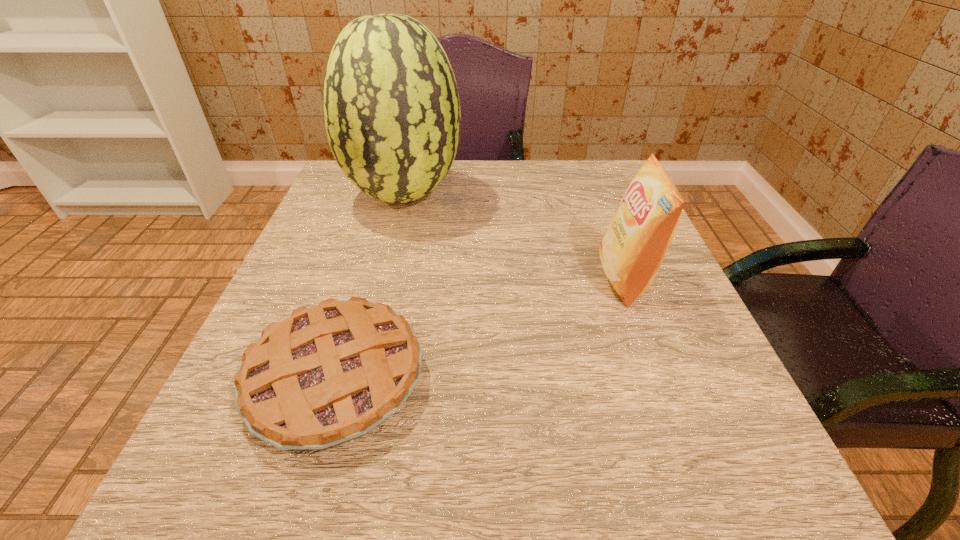
Find the location of `the tallest object`. the tallest object is located at coordinates (392, 114).

Find the location of a particular element. The width and height of the screenshot is (960, 540). the farthest object is located at coordinates (392, 114).

This screenshot has width=960, height=540. In order to click on the second nearest object in this screenshot , I will do `click(632, 249)`.

This screenshot has height=540, width=960. I want to click on the second shortest object, so click(x=632, y=249).

At what (x,y) coordinates should I click in order to perform the action: click on the nearest object. Please return your answer as a coordinate pair (x, y). The height and width of the screenshot is (540, 960). Looking at the image, I should click on (328, 374).

Where is `the shortest object`? The image size is (960, 540). the shortest object is located at coordinates (328, 374).

The width and height of the screenshot is (960, 540). Find the location of `free location located 0.170m on the right of the tallest object`. free location located 0.170m on the right of the tallest object is located at coordinates (534, 196).

At what (x,y) coordinates should I click in order to perform the action: click on free spot located 0.400m on the front-facing side of the crisp (potato chip). Please return your answer as a coordinate pair (x, y). Looking at the image, I should click on (386, 279).

At what (x,y) coordinates should I click in order to perform the action: click on vacant space located 0.290m on the front-facing side of the crisp (potato chip). Please return your answer as a coordinate pair (x, y). Image resolution: width=960 pixels, height=540 pixels. Looking at the image, I should click on (444, 279).

Image resolution: width=960 pixels, height=540 pixels. Identify the location of vacant region located 0.080m on the front-facing side of the crisp (potato chip). (557, 279).